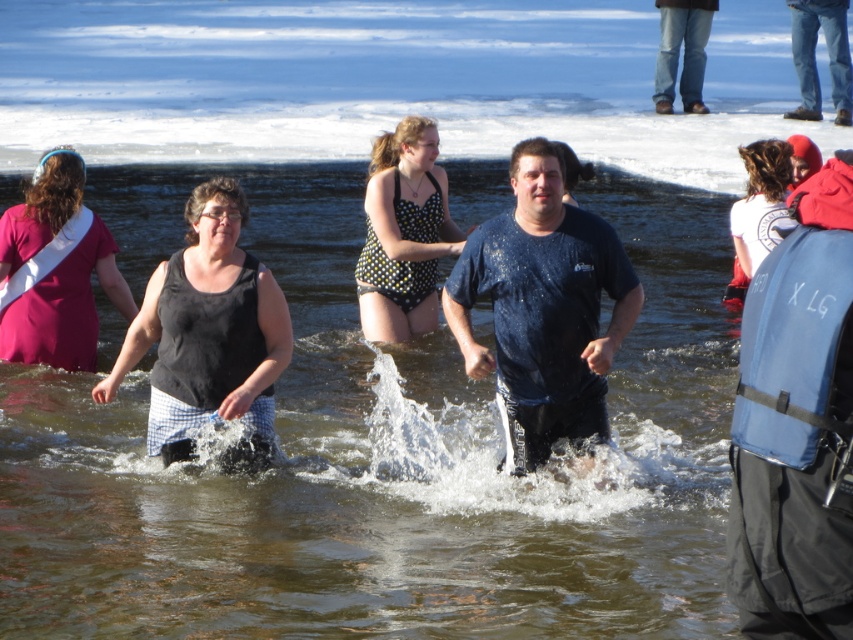
Between dark blue t-shirt at center and red fleece life jacket at upper right, which one has less height?

With less height is red fleece life jacket at upper right.

Describe the element at coordinates (543, 308) in the screenshot. The width and height of the screenshot is (853, 640). I see `dark blue t-shirt at center` at that location.

What are the coordinates of `dark blue t-shirt at center` in the screenshot? It's located at (543, 308).

Can you confirm if blue fabric life jacket at right is positioned to the left of white cotton shirt at upper right?

Yes, blue fabric life jacket at right is to the left of white cotton shirt at upper right.

Does blue fabric life jacket at right have a lesser height compared to white cotton shirt at upper right?

Yes, blue fabric life jacket at right is shorter than white cotton shirt at upper right.

Locate an element on the screen. The width and height of the screenshot is (853, 640). blue fabric life jacket at right is located at coordinates (793, 348).

You are a GUI agent. You are given a task and a screenshot of the screen. Output one action in this format:
    pyautogui.click(x=<x>, y=<y>)
    Task: Click on the blue fabric life jacket at right
    This screenshot has height=640, width=853.
    Given the screenshot: What is the action you would take?
    pyautogui.click(x=793, y=348)

Which is in front, point (519, 396) or point (817, 275)?

Positioned in front is point (817, 275).

Is point (572, 241) behind point (793, 410)?

Yes, it is.

Find the location of a particular element. This screenshot has height=640, width=853. dark blue t-shirt at center is located at coordinates (543, 308).